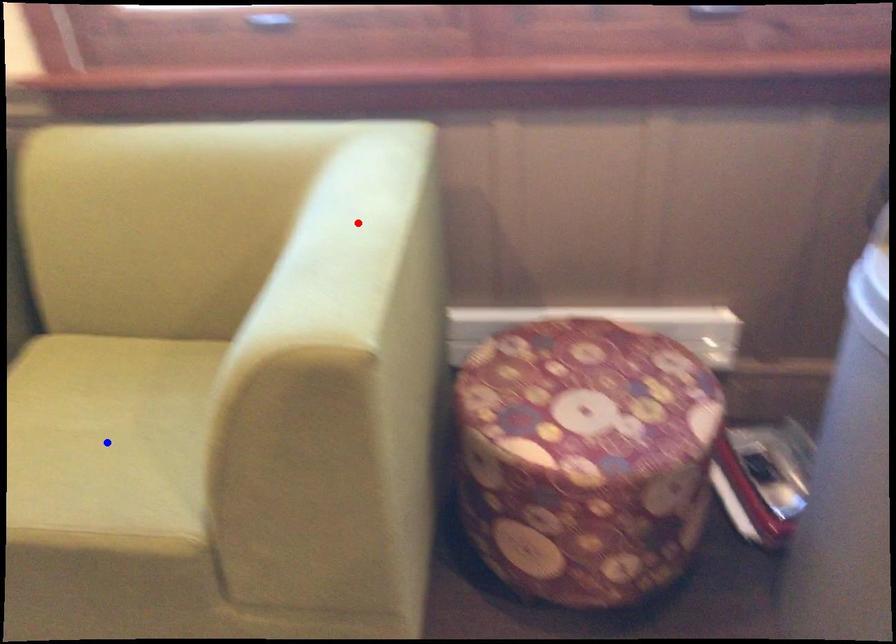
Question: Which of the two points in the image is closer to the camera?

Choices:
 (A) Blue point is closer.
 (B) Red point is closer.

Answer: (B)